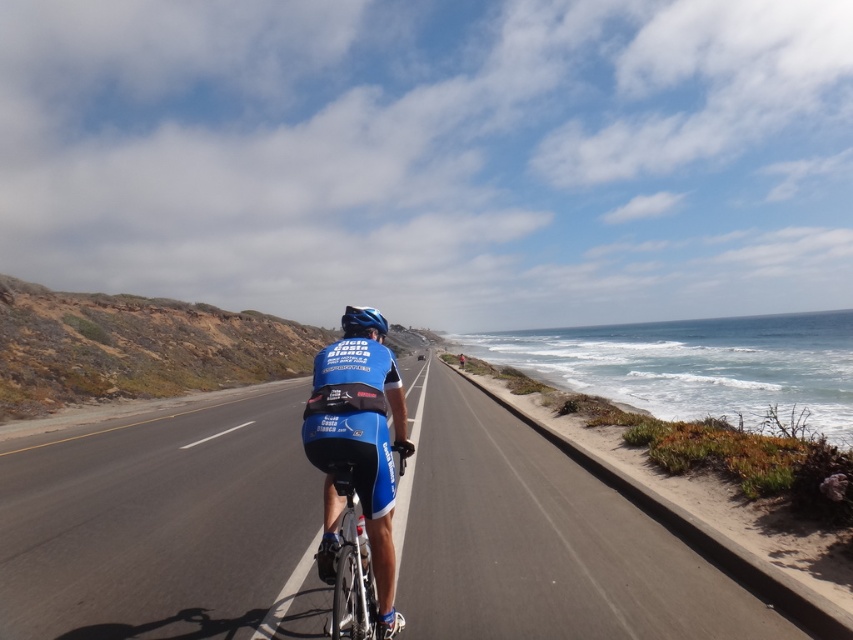
From the picture: Is smooth asphalt road at center positioned before shiny metallic bicycle at center?

No.

Does smooth asphalt road at center have a lesser height compared to shiny metallic bicycle at center?

Yes.

Does point (592, 605) come farther from viewer compared to point (343, 612)?

Yes, it is behind point (343, 612).

Locate an element on the screen. Image resolution: width=853 pixels, height=640 pixels. smooth asphalt road at center is located at coordinates (161, 525).

Does smooth asphalt road at center appear on the left side of blue matte helmet at center?

No, smooth asphalt road at center is not to the left of blue matte helmet at center.

Who is positioned more to the left, smooth asphalt road at center or blue matte helmet at center?

blue matte helmet at center

Where is `smooth asphalt road at center`? smooth asphalt road at center is located at coordinates (161, 525).

You are a GUI agent. You are given a task and a screenshot of the screen. Output one action in this format:
    pyautogui.click(x=<x>, y=<y>)
    Task: Click on the smooth asphalt road at center
    The image size is (853, 640).
    Given the screenshot: What is the action you would take?
    pyautogui.click(x=161, y=525)

From the picture: Can you confirm if blue fabric jersey at center is smaller than shiny metallic bicycle at center?

Actually, blue fabric jersey at center might be larger than shiny metallic bicycle at center.

Between point (317, 413) and point (351, 582), which one is positioned behind?

Point (317, 413)

Locate an element on the screen. The height and width of the screenshot is (640, 853). blue fabric jersey at center is located at coordinates (358, 451).